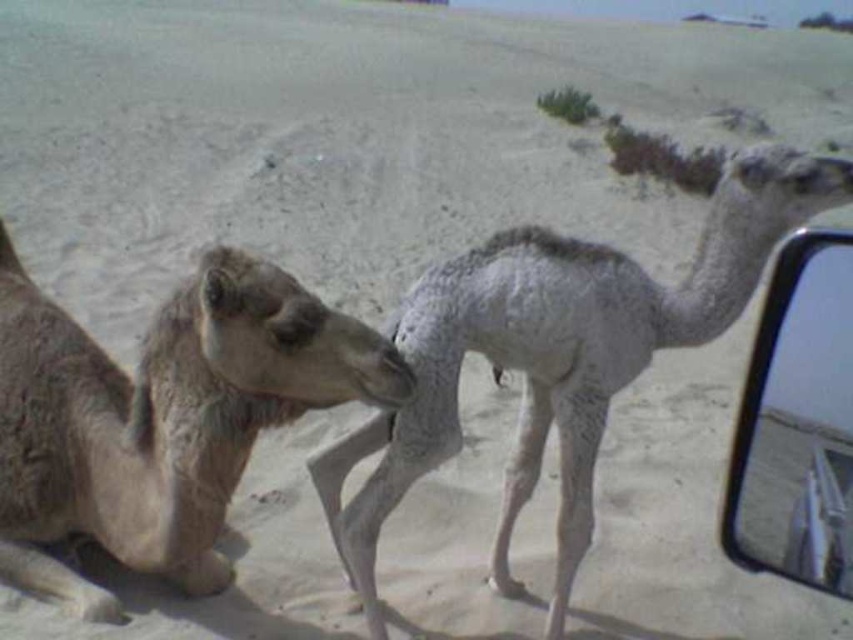
You are a traveler in the desert and need to check your reflection in the transparent plastic mirror at right. The gray speckled camel at right is blocking your view. Can you step around the camel to see your reflection?

The gray speckled camel at right is 1.13 meters away from the transparent plastic mirror at right, so you can step around the camel to see your reflection since there is enough space between them.

Looking at this image, you are a traveler in the desert and need to choose a camel to ride. The desert tan camel at left and the gray speckled camel at right are both available. Which camel would you choose based on their sizes?

The desert tan camel at left is larger in size than the gray speckled camel at right, so you should choose the desert tan camel at left for riding as it is bigger and likely more suitable for carrying you.

You are a traveler in the desert and need to choose a camel to ride. The desert tan camel at left and the gray speckled camel at right are both available. Based on their height, which camel would you choose and why?

The gray speckled camel at right is taller than the desert tan camel at left, so you should choose the gray speckled camel at right for riding as taller camels may provide a more comfortable ride.